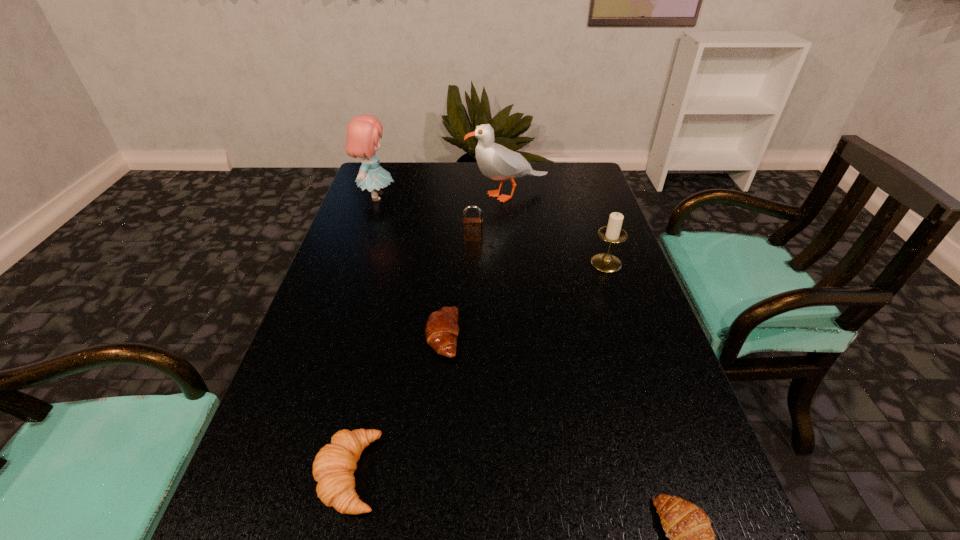
What are the coordinates of `doll` in the screenshot? It's located at (363, 132).

This screenshot has height=540, width=960. In order to click on gull in this screenshot , I will do `click(495, 161)`.

I want to click on the fifth shortest object, so click(x=605, y=262).

The width and height of the screenshot is (960, 540). Find the location of `the fourth nearest object`. the fourth nearest object is located at coordinates (605, 262).

The height and width of the screenshot is (540, 960). Identify the location of padlock. (472, 227).

The image size is (960, 540). What are the coordinates of `the fifth nearest object` in the screenshot? It's located at (472, 227).

You are a GUI agent. You are given a task and a screenshot of the screen. Output one action in this format:
    pyautogui.click(x=<x>, y=<y>)
    Task: Click on the third shortest object
    
    Given the screenshot: What is the action you would take?
    pyautogui.click(x=333, y=468)

Locate an element on the screen. the tallest crescent roll is located at coordinates (333, 468).

The image size is (960, 540). I want to click on the second crescent roll from right to left, so click(441, 331).

Identify the location of the fifth farthest object. (441, 331).